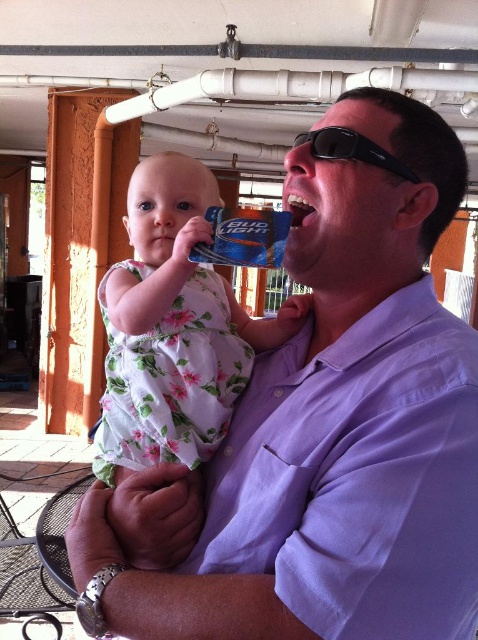
You are a photographer trying to capture a closeup shot of the purple cotton shirt at center and the white glossy teeth at center in the image. Which object should you zoom in on more to ensure both are in focus?

The purple cotton shirt at center is bigger than the white glossy teeth at center, so you should zoom in more on the white glossy teeth at center to ensure both are in focus.

You are a photographer trying to frame a shot of the purple cotton shirt at center and the white glossy teeth at center. Since you want to ensure both are visible, which object should you adjust your focus to prioritize in terms of size? Explain your reasoning based on their relative sizes.

The purple cotton shirt at center is wider than the white glossy teeth at center. To ensure both are visible, prioritize focusing on the purple cotton shirt at center first since it occupies more space, allowing the smaller white glossy teeth at center to fit within the frame more easily.